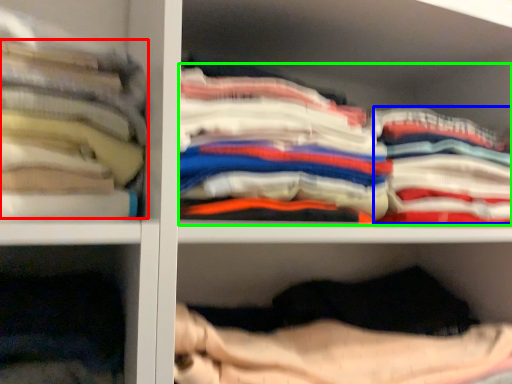
Question: Considering the real-world distances, which object is closest to clothing (highlighted by a red box)? clothing (highlighted by a blue box) or clothing (highlighted by a green box).

Choices:
 (A) clothing
 (B) clothing

Answer: (B)